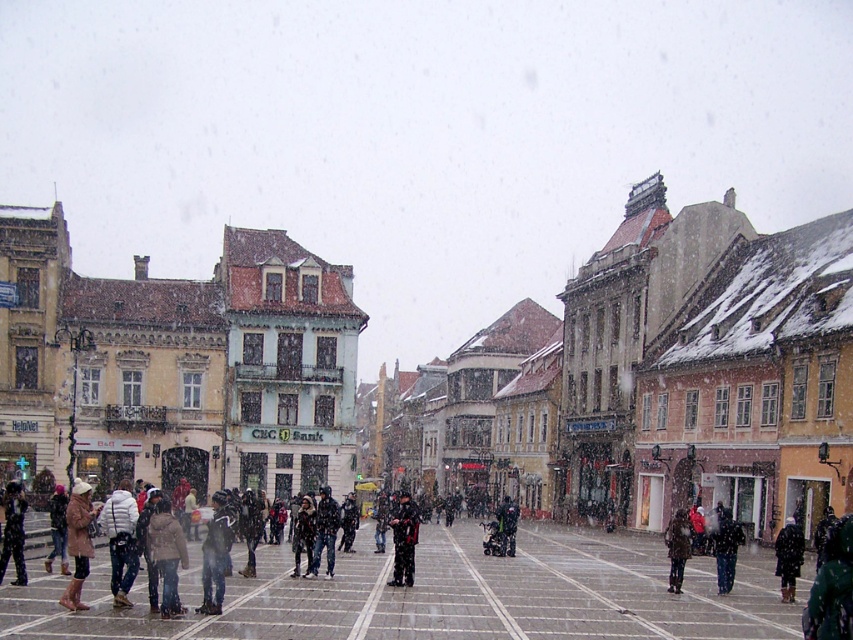
Question: Among these points, which one is farthest from the camera?

Choices:
 (A) (326, 536)
 (B) (786, 547)
 (C) (410, 515)

Answer: (A)

Question: Which of the following is the closest to the observer?

Choices:
 (A) tan suede coat at lower left
 (B) dark gray jacket at center

Answer: (B)

Question: Which of the following is the farthest from the observer?

Choices:
 (A) dark brown leather coat at center
 (B) dark gray jacket at center
 (C) white fuzzy coat at lower left

Answer: (A)

Question: Does brown leather coat at lower left appear under dark brown leather coat at lower right?

Choices:
 (A) yes
 (B) no

Answer: (B)

Question: In this image, where is tan suede coat at lower left located relative to dark green fabric jacket at center?

Choices:
 (A) left
 (B) right

Answer: (A)

Question: Does white fuzzy coat at lower left have a larger size compared to dark blue jeans at center?

Choices:
 (A) yes
 (B) no

Answer: (A)